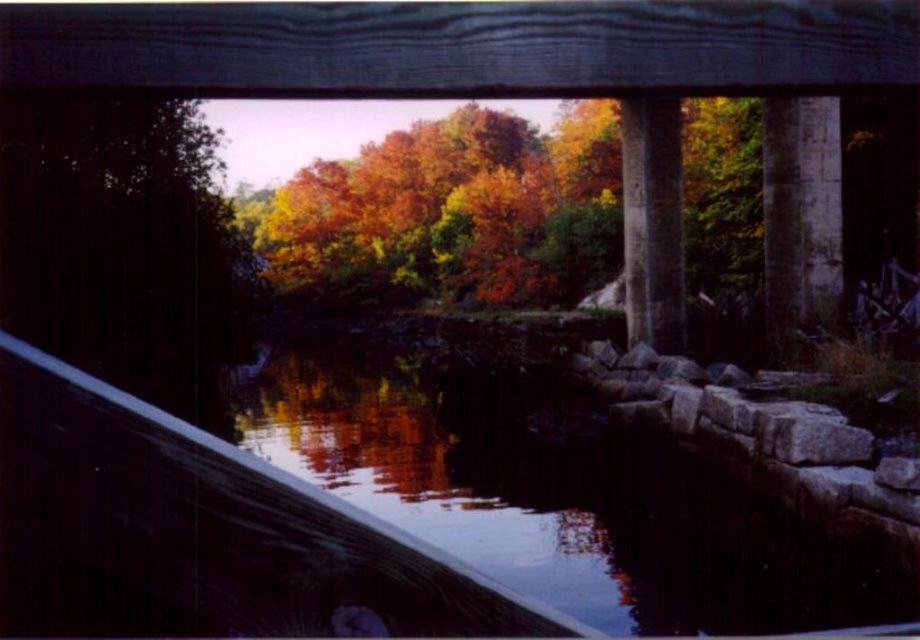
Question: Is the position of smooth stone river at center less distant than that of gray concrete pillar at center-right?

Choices:
 (A) no
 (B) yes

Answer: (A)

Question: Which of the following is the farthest from the observer?

Choices:
 (A) (648, 202)
 (B) (808, 147)

Answer: (A)

Question: Is smooth stone river at center positioned before gray concrete pillar at center-right?

Choices:
 (A) no
 (B) yes

Answer: (A)

Question: Can you confirm if smooth stone river at center is positioned to the right of gray concrete pillar at right?

Choices:
 (A) yes
 (B) no

Answer: (B)

Question: Which is nearer to the gray concrete pillar at center-right?

Choices:
 (A) smooth stone river at center
 (B) gray concrete pillar at right

Answer: (B)

Question: Which object is the farthest from the smooth stone river at center?

Choices:
 (A) gray concrete pillar at right
 (B) gray concrete pillar at center-right

Answer: (A)